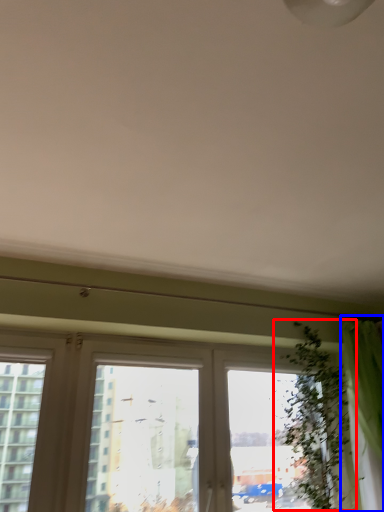
Question: Which object is further to the camera taking this photo, vegetation (highlighted by a red box) or curtain (highlighted by a blue box)?

Choices:
 (A) vegetation
 (B) curtain

Answer: (A)